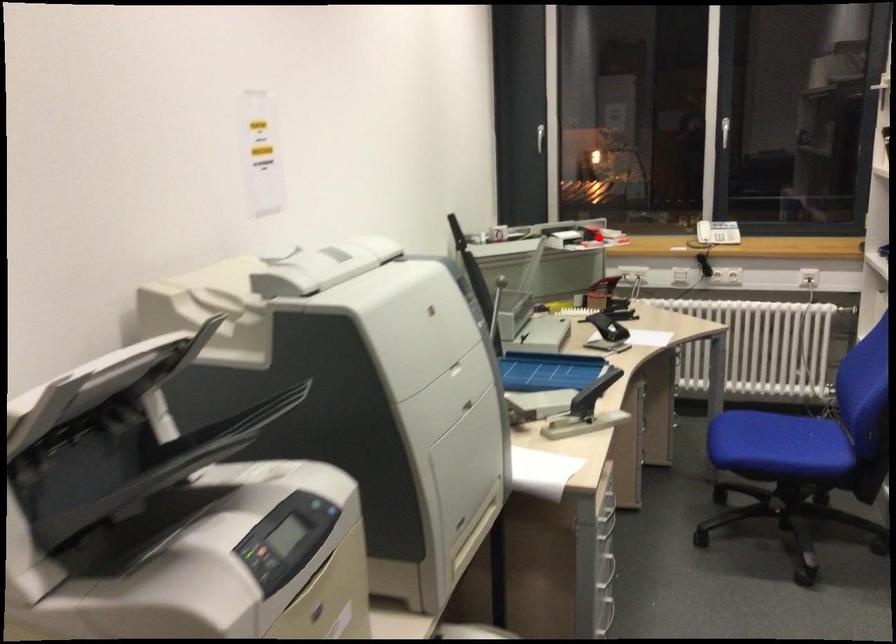
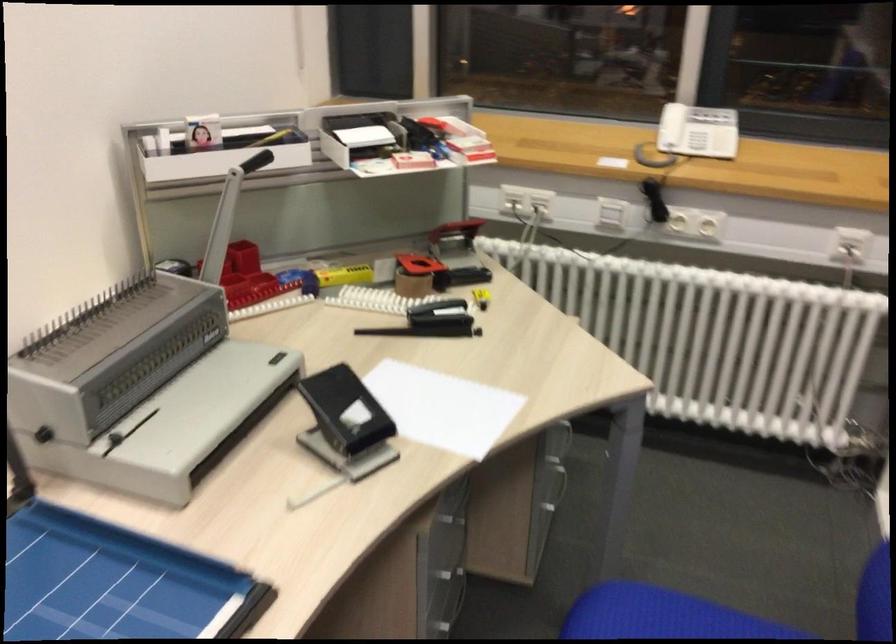
Question: I am providing you with two images of the same scene from different viewpoints. Given a red point in image1, look at the same physical point in image2. Is it:

Choices:
 (A) Closer to the viewpoint
 (B) Farther from the viewpoint

Answer: (A)